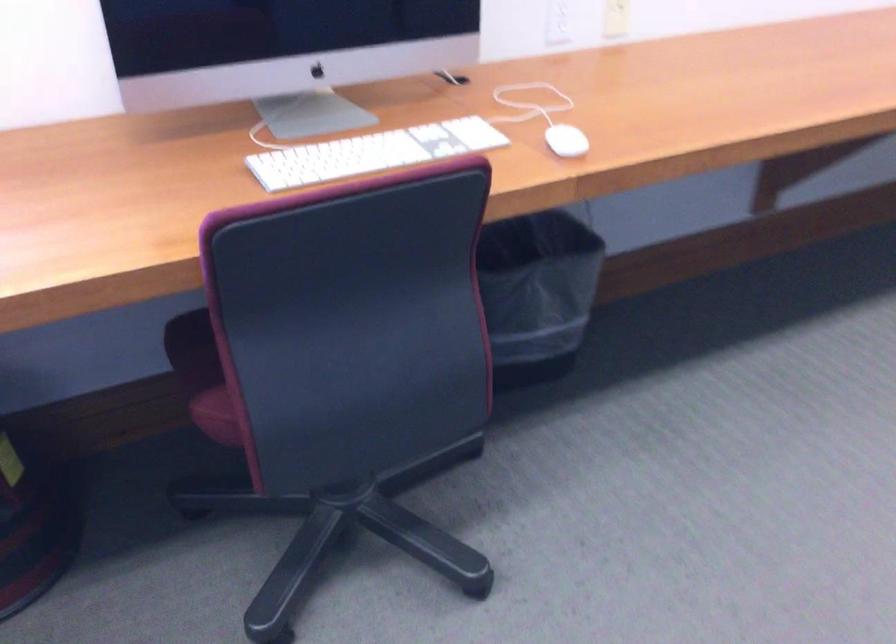
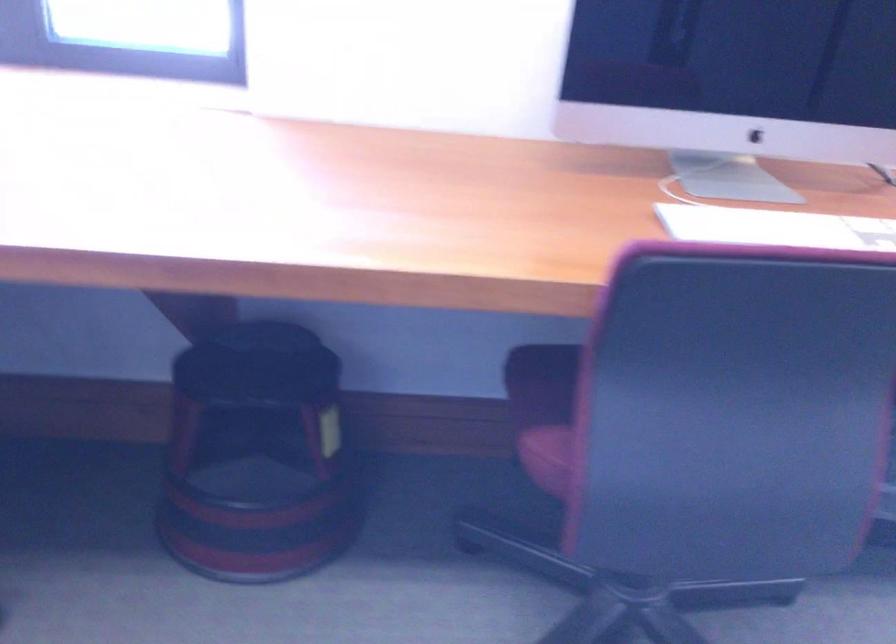
What movement of the cameraman would produce the second image?

The cameraman moved toward left, forward.